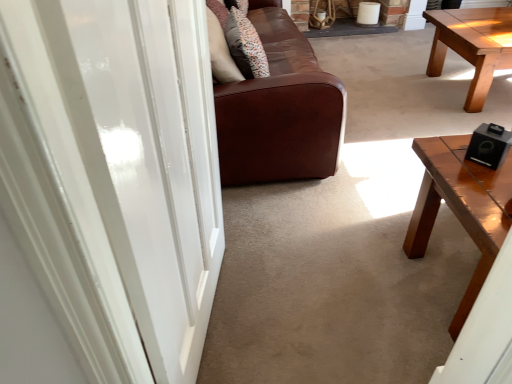
Question: Should I look upward or downward to see black matte speaker at right?

Choices:
 (A) up
 (B) down

Answer: (A)

Question: Is black matte speaker at right completely or partially inside brown leather couch at center?

Choices:
 (A) no
 (B) yes

Answer: (A)

Question: Considering the relative sizes of brown leather couch at center and black matte speaker at right in the image provided, is brown leather couch at center bigger than black matte speaker at right?

Choices:
 (A) no
 (B) yes

Answer: (B)

Question: Is brown leather couch at center beside black matte speaker at right?

Choices:
 (A) no
 (B) yes

Answer: (A)

Question: Does brown leather couch at center appear on the right side of black matte speaker at right?

Choices:
 (A) no
 (B) yes

Answer: (A)

Question: Is brown leather couch at center further to the viewer compared to black matte speaker at right?

Choices:
 (A) no
 (B) yes

Answer: (B)

Question: Is brown leather couch at center positioned far away from black matte speaker at right?

Choices:
 (A) no
 (B) yes

Answer: (B)

Question: Considering the relative sizes of black matte speaker at right and white glossy door at center in the image provided, is black matte speaker at right shorter than white glossy door at center?

Choices:
 (A) yes
 (B) no

Answer: (A)

Question: From a real-world perspective, is black matte speaker at right located beneath white glossy door at center?

Choices:
 (A) no
 (B) yes

Answer: (B)

Question: Is black matte speaker at right to the right of white glossy door at center from the viewer's perspective?

Choices:
 (A) yes
 (B) no

Answer: (A)

Question: Considering the relative sizes of black matte speaker at right and white glossy door at center in the image provided, is black matte speaker at right smaller than white glossy door at center?

Choices:
 (A) yes
 (B) no

Answer: (A)

Question: Is black matte speaker at right to the left of white glossy door at center from the viewer's perspective?

Choices:
 (A) yes
 (B) no

Answer: (B)

Question: Is black matte speaker at right taller than white glossy door at center?

Choices:
 (A) yes
 (B) no

Answer: (B)

Question: Is black matte speaker at right further to camera compared to patterned fabric pillow at center?

Choices:
 (A) yes
 (B) no

Answer: (B)